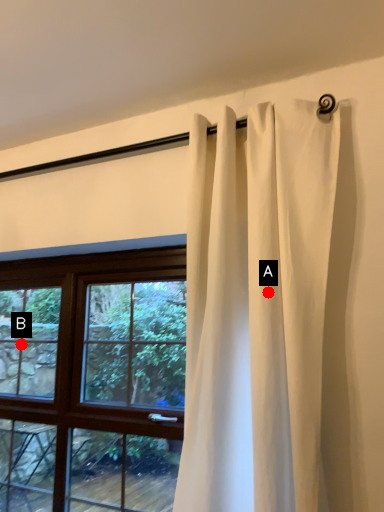
Question: Two points are circled on the image, labeled by A and B beside each circle. Which point is farther from the camera taking this photo?

Choices:
 (A) A is further
 (B) B is further

Answer: (B)